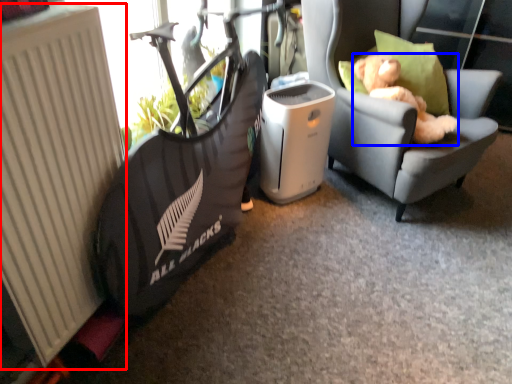
Question: Which object appears farthest to the camera in this image, radiator (highlighted by a red box) or animal (highlighted by a blue box)?

Choices:
 (A) radiator
 (B) animal

Answer: (B)